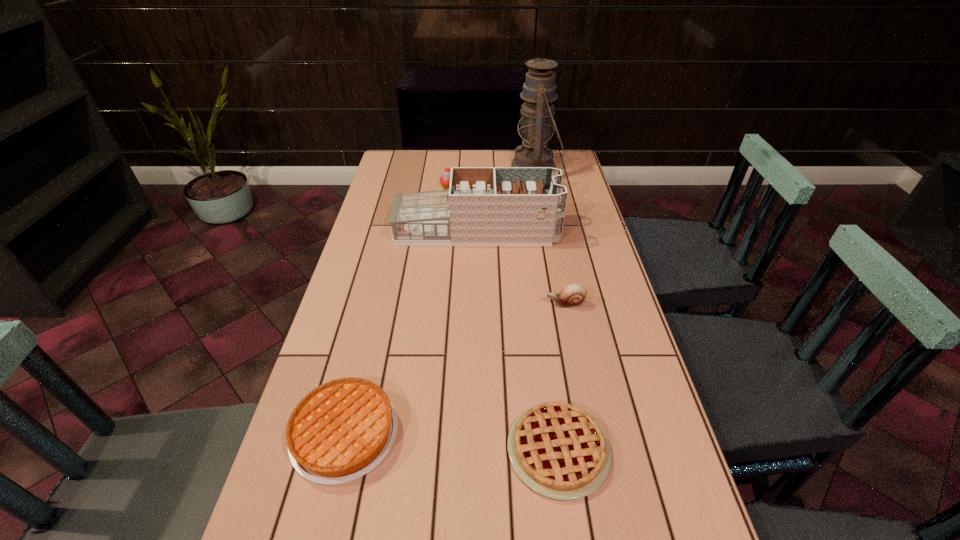
Where is `free space located on the front of the oil lamp`? Image resolution: width=960 pixels, height=540 pixels. free space located on the front of the oil lamp is located at coordinates (541, 199).

Locate an element on the screen. The width and height of the screenshot is (960, 540). free space located 0.090m at the entrance of the third farthest object is located at coordinates (585, 231).

Locate an element on the screen. The height and width of the screenshot is (540, 960). vacant area situated on the right of the cupcake is located at coordinates (536, 187).

I want to click on free space located 0.270m on the front-facing side of the fourth farthest object, so [446, 304].

The height and width of the screenshot is (540, 960). What are the coordinates of `vacant space located on the front-facing side of the fourth farthest object` in the screenshot? It's located at (487, 304).

What are the coordinates of `free space located 0.380m on the front-facing side of the fourth farthest object` in the screenshot? It's located at (406, 304).

I want to click on blank area located 0.050m on the front of the second shortest object, so pyautogui.click(x=324, y=515).

Find the location of a particular element. The image size is (960, 540). vacant region located on the back of the shorter pie is located at coordinates (540, 315).

Locate an element on the screen. This screenshot has width=960, height=540. object located in the far edge section of the desktop is located at coordinates (537, 122).

Locate an element on the screen. This screenshot has height=540, width=960. dollhouse located in the left edge section of the desktop is located at coordinates (483, 206).